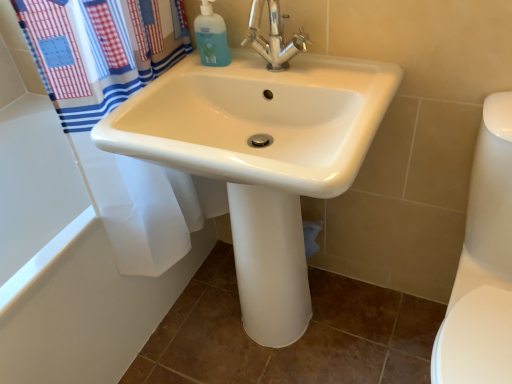
Question: Is polished chrome faucet at center to the left of white glossy bathtub at lower left from the viewer's perspective?

Choices:
 (A) no
 (B) yes

Answer: (A)

Question: Is polished chrome faucet at center outside of white glossy bathtub at lower left?

Choices:
 (A) yes
 (B) no

Answer: (A)

Question: Is polished chrome faucet at center next to white glossy bathtub at lower left?

Choices:
 (A) no
 (B) yes

Answer: (A)

Question: Is polished chrome faucet at center further to the viewer compared to white glossy bathtub at lower left?

Choices:
 (A) yes
 (B) no

Answer: (B)

Question: Considering the relative sizes of polished chrome faucet at center and white glossy bathtub at lower left in the image provided, is polished chrome faucet at center wider than white glossy bathtub at lower left?

Choices:
 (A) no
 (B) yes

Answer: (A)

Question: Is point (158, 311) positioned closer to the camera than point (259, 336)?

Choices:
 (A) farther
 (B) closer

Answer: (A)

Question: Would you say white glossy bathtub at lower left is to the left or to the right of white glossy sink at center in the picture?

Choices:
 (A) right
 (B) left

Answer: (B)

Question: Based on their sizes in the image, would you say white glossy bathtub at lower left is bigger or smaller than white glossy sink at center?

Choices:
 (A) small
 (B) big

Answer: (B)

Question: From the image's perspective, is white glossy bathtub at lower left positioned above or below white glossy sink at center?

Choices:
 (A) below
 (B) above

Answer: (A)

Question: From the image's perspective, relative to white glossy sink at center, is polished chrome faucet at center above or below?

Choices:
 (A) below
 (B) above

Answer: (B)

Question: From their relative heights in the image, would you say polished chrome faucet at center is taller or shorter than white glossy sink at center?

Choices:
 (A) tall
 (B) short

Answer: (B)

Question: Considering the positions of point (272, 54) and point (346, 69), is point (272, 54) closer or farther from the camera than point (346, 69)?

Choices:
 (A) farther
 (B) closer

Answer: (A)

Question: From a real-world perspective, is polished chrome faucet at center positioned above or below white glossy sink at center?

Choices:
 (A) below
 (B) above

Answer: (B)

Question: Does point (210, 36) appear closer or farther from the camera than point (80, 372)?

Choices:
 (A) closer
 (B) farther

Answer: (A)

Question: Is translucent plastic bottle at upper center in front of or behind white glossy bathtub at lower left in the image?

Choices:
 (A) behind
 (B) front

Answer: (A)